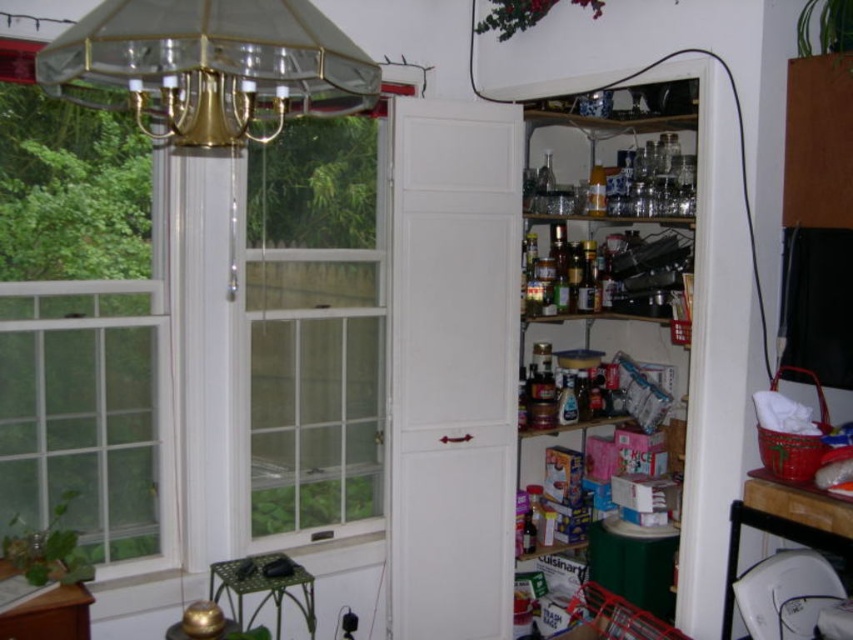
Does point (287, 432) come in front of point (590, 256)?

Yes.

Can you confirm if clear glass window at center is smaller than clear plastic containers at upper right?

Yes, clear glass window at center is smaller than clear plastic containers at upper right.

Image resolution: width=853 pixels, height=640 pixels. What do you see at coordinates (316, 324) in the screenshot? I see `clear glass window at center` at bounding box center [316, 324].

This screenshot has height=640, width=853. What are the coordinates of `clear glass window at center` in the screenshot? It's located at (316, 324).

Does clear glass window at left appear over clear plastic containers at upper right?

No, clear glass window at left is not above clear plastic containers at upper right.

Between point (57, 388) and point (703, 216), which one is positioned behind?

Positioned behind is point (703, 216).

Between point (35, 416) and point (643, 96), which one is positioned behind?

Point (643, 96)

Where is `clear glass window at left`? clear glass window at left is located at coordinates (83, 321).

Does clear glass window at center appear over gold/metallic chandelier at upper left?

Incorrect, clear glass window at center is not positioned above gold/metallic chandelier at upper left.

Is point (370, 248) positioned behind point (370, 61)?

That is True.

Who is more forward, (343, 401) or (263, 109)?

Positioned in front is point (263, 109).

In order to click on clear glass window at center in this screenshot , I will do `click(316, 324)`.